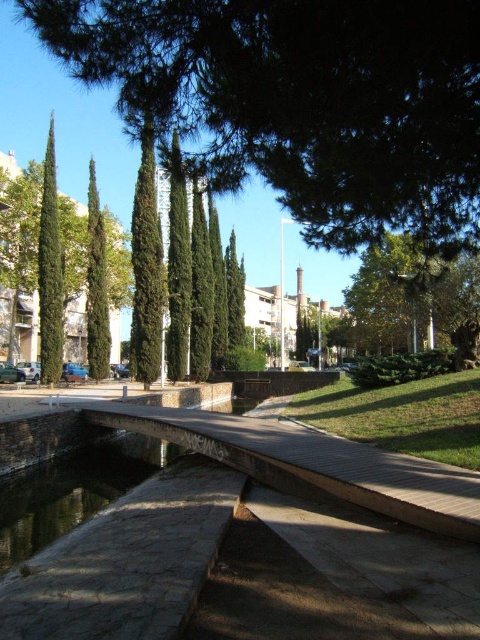
Question: Estimate the real-world distances between objects in this image. Which object is closer to the green textured tree at center?

Choices:
 (A) green leafy tree at center
 (B) smooth stone water at lower left
 (C) green needle-like at center

Answer: (B)

Question: Is the position of green leafy tree at center more distant than that of green textured tree at center?

Choices:
 (A) yes
 (B) no

Answer: (B)

Question: Which object is the closest to the green leafy tree at center?

Choices:
 (A) green needle-like at center
 (B) smooth stone water at lower left
 (C) green textured tree at center

Answer: (B)

Question: Which of the following is the closest to the observer?

Choices:
 (A) green textured tree at center
 (B) green leafy tree at center
 (C) smooth stone water at lower left

Answer: (C)

Question: In this image, where is smooth stone water at lower left located relative to green textured tree at center?

Choices:
 (A) below
 (B) above

Answer: (A)

Question: Observing the image, what is the correct spatial positioning of smooth stone water at lower left in reference to green leafy tree at center?

Choices:
 (A) right
 (B) left

Answer: (B)